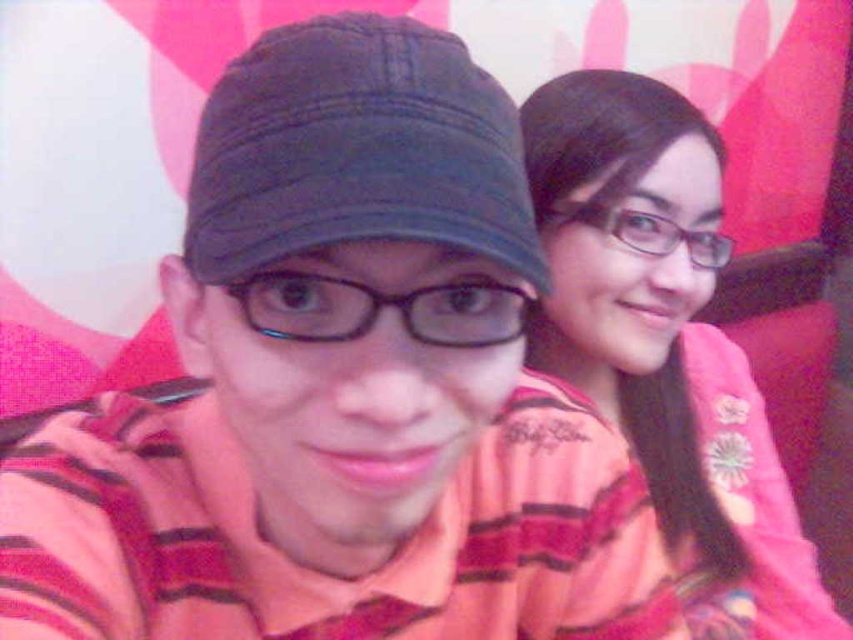
Question: Is pink striped shirt at upper right positioned before dark blue fabric cap at center?

Choices:
 (A) yes
 (B) no

Answer: (B)

Question: Observing the image, what is the correct spatial positioning of pink striped shirt at upper right in reference to dark blue fabric cap at center?

Choices:
 (A) above
 (B) below

Answer: (B)

Question: Does pink striped shirt at upper right appear on the left side of dark blue fabric cap at center?

Choices:
 (A) no
 (B) yes

Answer: (A)